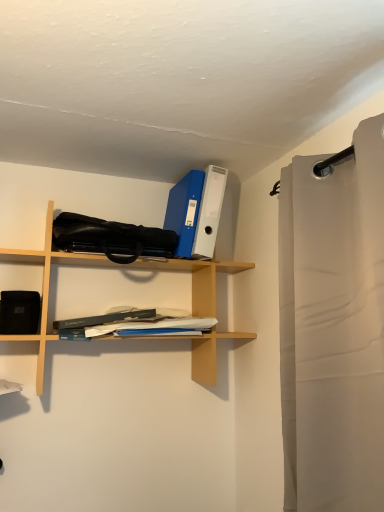
Question: Does wooden shelf at upper center have a lesser height compared to white paper at center?

Choices:
 (A) yes
 (B) no

Answer: (B)

Question: From a real-world perspective, is wooden shelf at upper center below white paper at center?

Choices:
 (A) yes
 (B) no

Answer: (B)

Question: From a real-world perspective, is wooden shelf at upper center on top of white paper at center?

Choices:
 (A) yes
 (B) no

Answer: (A)

Question: Can you see wooden shelf at upper center touching white paper at center?

Choices:
 (A) no
 (B) yes

Answer: (A)

Question: Is wooden shelf at upper center located outside white paper at center?

Choices:
 (A) yes
 (B) no

Answer: (A)

Question: From the image's perspective, is wooden shelf at upper center beneath white paper at center?

Choices:
 (A) no
 (B) yes

Answer: (A)

Question: From a real-world perspective, is white paper at center positioned under light beige fabric shower curtain at right based on gravity?

Choices:
 (A) yes
 (B) no

Answer: (B)

Question: Considering the relative sizes of white paper at center and light beige fabric shower curtain at right in the image provided, is white paper at center thinner than light beige fabric shower curtain at right?

Choices:
 (A) yes
 (B) no

Answer: (A)

Question: Is white paper at center touching light beige fabric shower curtain at right?

Choices:
 (A) no
 (B) yes

Answer: (A)

Question: From the image's perspective, does white paper at center appear higher than light beige fabric shower curtain at right?

Choices:
 (A) yes
 (B) no

Answer: (B)

Question: Is white paper at center in front of light beige fabric shower curtain at right?

Choices:
 (A) no
 (B) yes

Answer: (A)

Question: Is white paper at center positioned beyond the bounds of light beige fabric shower curtain at right?

Choices:
 (A) yes
 (B) no

Answer: (A)

Question: Considering the relative positions of black matte speaker at left and light beige fabric shower curtain at right in the image provided, is black matte speaker at left to the right of light beige fabric shower curtain at right from the viewer's perspective?

Choices:
 (A) yes
 (B) no

Answer: (B)